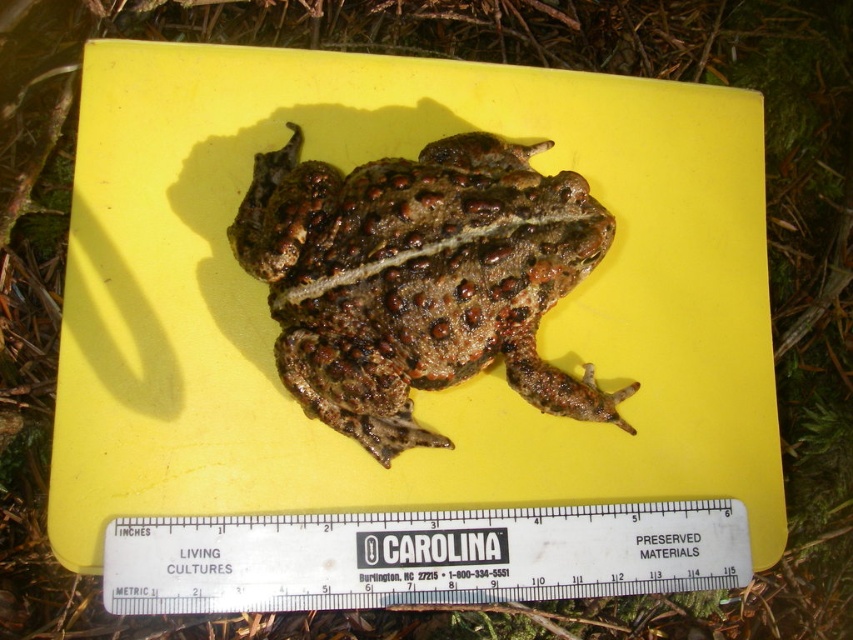
You are a biology student observing a toad on a yellow surface. You notice the spotted brown skin at center and the white plastic ruler at center. Based on their positions, which object is closer to you?

The spotted brown skin at center is above the white plastic ruler at center, so the spotted brown skin at center is closer to you.